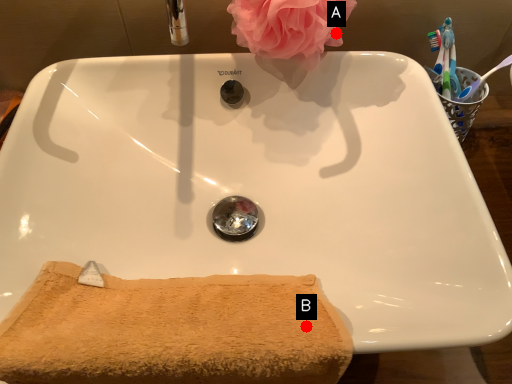
Question: Two points are circled on the image, labeled by A and B beside each circle. Which point is farther to the camera?

Choices:
 (A) A is further
 (B) B is further

Answer: (A)